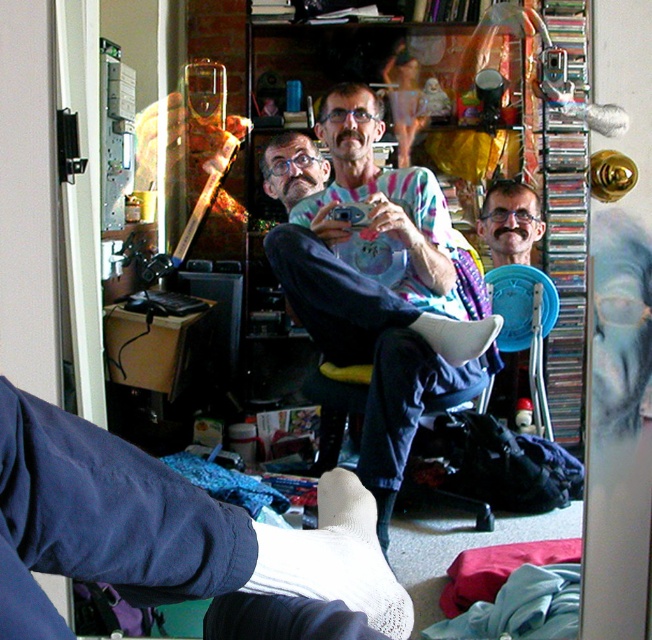
You are organizing a space and need to place a small plant between the white mesh sock at lower center and the blue plastic chair at center. Which object should the plant be closer to if it needs to be placed closer to the taller object?

The blue plastic chair at center is taller than the white mesh sock at lower center, so the plant should be placed closer to the blue plastic chair at center.

You are standing in the home office scene. There is a point at coordinates (334, 557). What object is located at that point?

The point at coordinates (334, 557) is on the white mesh sock at lower center.